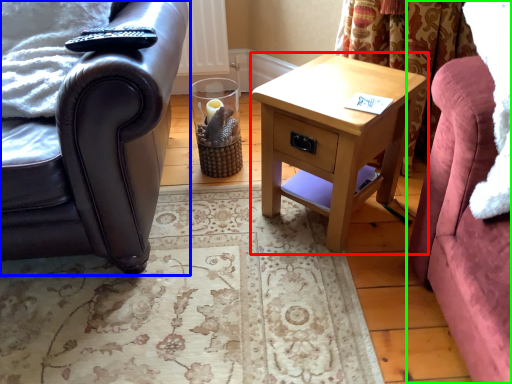
Question: Considering the real-world distances, which object is closest to nightstand (highlighted by a red box)? chair (highlighted by a blue box) or studio couch (highlighted by a green box).

Choices:
 (A) chair
 (B) studio couch

Answer: (B)